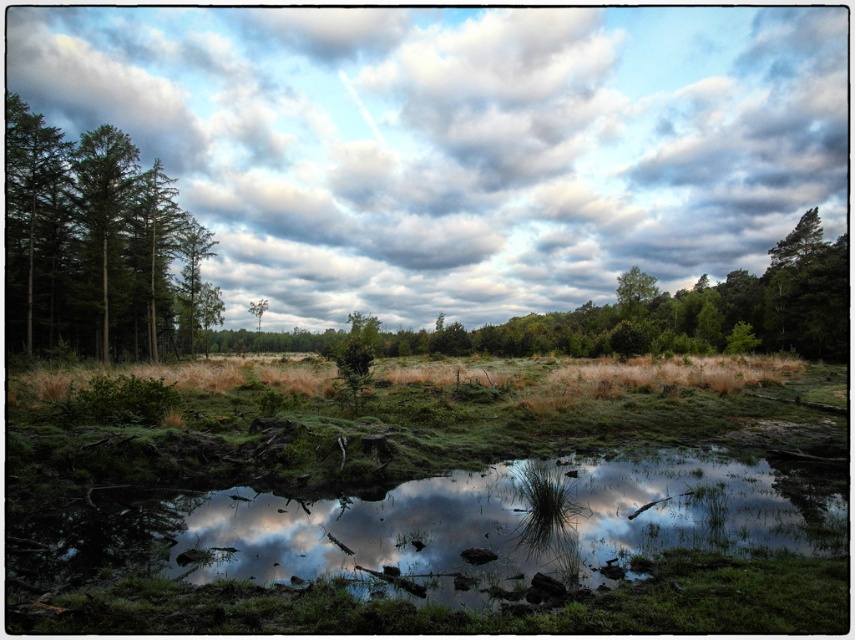
Which is behind, point (429, 284) or point (39, 250)?

The point (429, 284) is more distant.

Consider the image. Is cloudy sky at upper center to the left of green matte tree at left from the viewer's perspective?

Incorrect, cloudy sky at upper center is not on the left side of green matte tree at left.

What do you see at coordinates (458, 144) in the screenshot?
I see `cloudy sky at upper center` at bounding box center [458, 144].

You are a GUI agent. You are given a task and a screenshot of the screen. Output one action in this format:
    pyautogui.click(x=<x>, y=<y>)
    Task: Click on the cloudy sky at upper center
    This screenshot has height=640, width=855.
    Given the screenshot: What is the action you would take?
    pyautogui.click(x=458, y=144)

Can you confirm if green matte trees at left is smaller than green matte tree at left?

No, green matte trees at left is not smaller than green matte tree at left.

Is point (140, 340) in front of point (49, 148)?

No.

Where is `green matte trees at left`? Image resolution: width=855 pixels, height=640 pixels. green matte trees at left is located at coordinates (92, 243).

Does cloudy sky at upper center have a greater height compared to green matte trees at left?

Correct, cloudy sky at upper center is much taller as green matte trees at left.

Measure the distance between point [373,205] and camera.

A distance of 205.41 meters exists between point [373,205] and camera.

The height and width of the screenshot is (640, 855). Describe the element at coordinates (458, 144) in the screenshot. I see `cloudy sky at upper center` at that location.

At what (x,y) coordinates should I click in order to perform the action: click on cloudy sky at upper center. Please return your answer as a coordinate pair (x, y). Looking at the image, I should click on (458, 144).